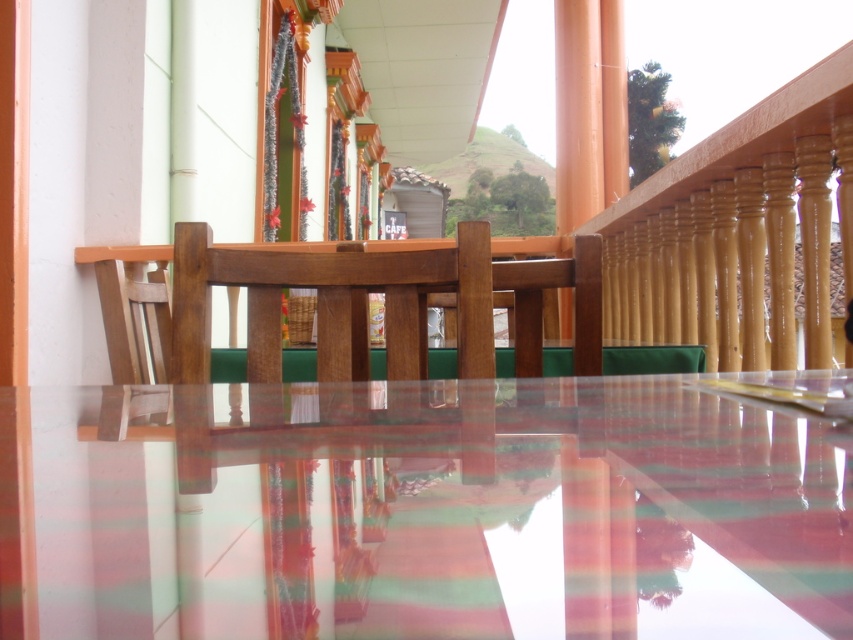
You are a server carrying a tray of drinks and need to place them on the transparent glossy glass table at center. Considering the table is 13.99 centimeters away from you, can you reach it without moving closer?

The transparent glossy glass table at center is 13.99 centimeters away from the viewer. Since the average human arm length is about 60 centimeters, you can easily reach the table without needing to move closer.

You are a server at the outdoor cafe and need to place a 60 cm wide tray on the table. The tray must be placed between the transparent glossy glass table at center and the wooden chair at center. Can the tray fit in that space?

The transparent glossy glass table at center and wooden chair at center are 66.32 centimeters apart, so yes, the 60 cm wide tray can fit between them since 66.32 cm is greater than 60 cm.

You are standing at the entrance of the outdoor area and want to place a large potted plant on the transparent glossy glass table at center. Based on the scene description, can you confirm if the table is positioned in a central location relative to the entrance?

The transparent glossy glass table at center is located at coordinates approximately 0.802 on the x and 0.497 on the y axis, which places it centrally within the scene, so yes, it is positioned centrally relative to the entrance.